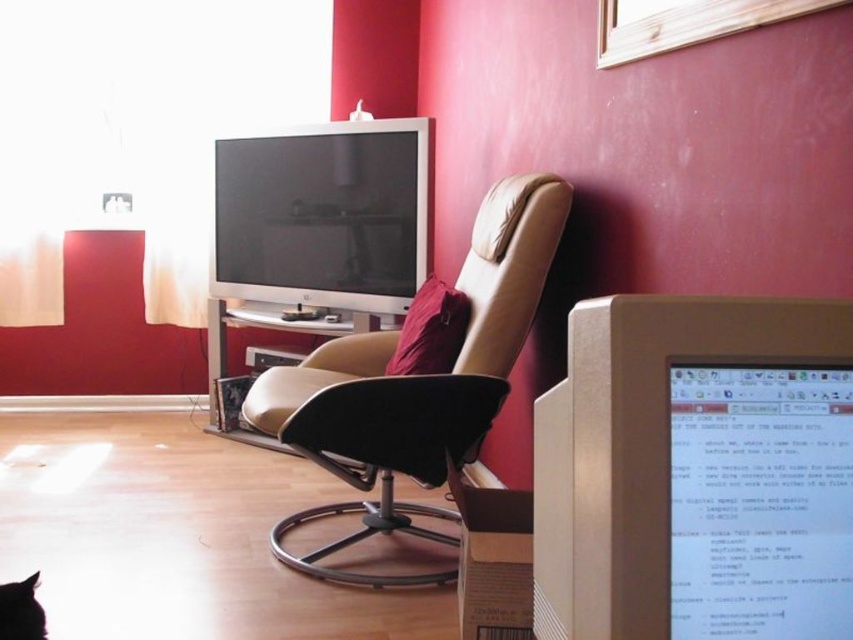
Based on the photo, measure the distance from matte gray monitor at right to matte black monitor at upper center.

They are 8.15 feet apart.

Who is more forward, (x=843, y=404) or (x=386, y=202)?

Point (x=843, y=404) is more forward.

Image resolution: width=853 pixels, height=640 pixels. I want to click on matte gray monitor at right, so coord(689,467).

Find the location of `matte gray monitor at right`. matte gray monitor at right is located at coordinates (689, 467).

Find the location of `matte gray monitor at right`. matte gray monitor at right is located at coordinates (689, 467).

Is matte gray monitor at right taller than black fur cat at lower left?

Yes, matte gray monitor at right is taller than black fur cat at lower left.

Measure the distance between matte gray monitor at right and camera.

A distance of 52.41 centimeters exists between matte gray monitor at right and camera.

Identify the location of matte gray monitor at right. The image size is (853, 640). [689, 467].

Does matte black monitor at upper center lie behind black fur cat at lower left?

Yes.

Can you confirm if matte black monitor at upper center is bigger than black fur cat at lower left?

Yes, matte black monitor at upper center is bigger than black fur cat at lower left.

The width and height of the screenshot is (853, 640). What do you see at coordinates (323, 216) in the screenshot?
I see `matte black monitor at upper center` at bounding box center [323, 216].

Find the location of a particular element. The height and width of the screenshot is (640, 853). matte black monitor at upper center is located at coordinates (323, 216).